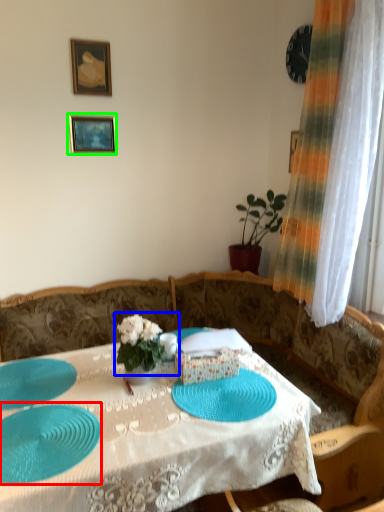
Question: Estimate the real-world distances between objects in this image. Which object is closer to glass plate (highlighted by a red box), floral arrangement (highlighted by a blue box) or picture frame (highlighted by a green box)?

Choices:
 (A) floral arrangement
 (B) picture frame

Answer: (A)